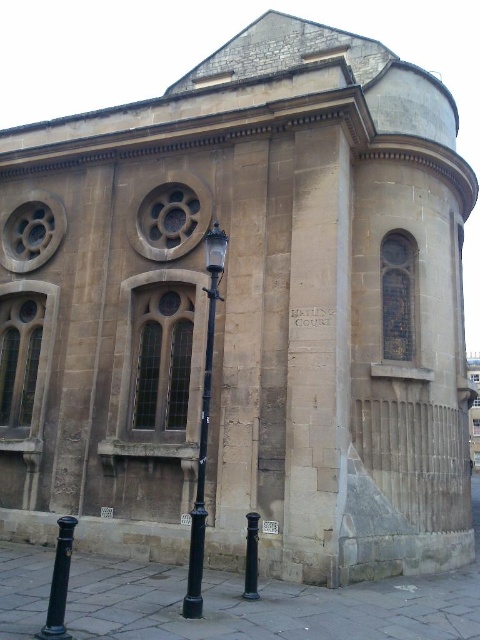
Question: Which point is farther to the camera?

Choices:
 (A) black metal streetlight at center
 (B) black metal pole at lower left
 (C) green metallic pole at lower center

Answer: (C)

Question: Does black metal streetlight at center have a larger size compared to black metal pole at lower left?

Choices:
 (A) no
 (B) yes

Answer: (B)

Question: Which object is closer to the camera taking this photo?

Choices:
 (A) black metal pole at lower left
 (B) black metal streetlight at center
 (C) green metallic pole at lower center

Answer: (A)

Question: Does black metal streetlight at center appear on the left side of green metallic pole at lower center?

Choices:
 (A) no
 (B) yes

Answer: (B)

Question: Does black metal pole at lower left have a greater width compared to green metallic pole at lower center?

Choices:
 (A) yes
 (B) no

Answer: (A)

Question: Which point is farther to the camera?

Choices:
 (A) (56, 593)
 (B) (206, 291)

Answer: (B)